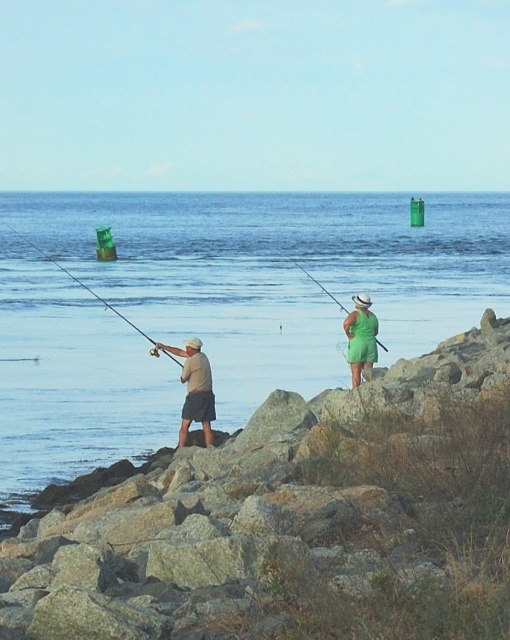
Who is positioned more to the right, blue water at center or matte black fishing pole at left?

Positioned to the right is blue water at center.

Describe the element at coordinates (214, 307) in the screenshot. I see `blue water at center` at that location.

At what (x,y) coordinates should I click in order to perform the action: click on blue water at center. Please return your answer as a coordinate pair (x, y). The height and width of the screenshot is (640, 510). Looking at the image, I should click on (214, 307).

Which of these two, blue water at center or tan cotton shirt at center, stands taller?

blue water at center is taller.

From the picture: Does blue water at center appear over tan cotton shirt at center?

Indeed, blue water at center is positioned over tan cotton shirt at center.

Is point (175, 412) positioned before point (195, 358)?

No, it is behind (195, 358).

Identify the location of blue water at center. This screenshot has width=510, height=640. (214, 307).

Looking at this image, which of these two, matte black fishing pole at left or green fabric fishing pole at center, stands taller?

Standing taller between the two is matte black fishing pole at left.

Who is shorter, matte black fishing pole at left or green fabric fishing pole at center?

With less height is green fabric fishing pole at center.

Who is more forward, (167, 353) or (313, 276)?

Point (167, 353) is in front.

Identify the location of matte black fishing pole at left. The image size is (510, 640). (78, 280).